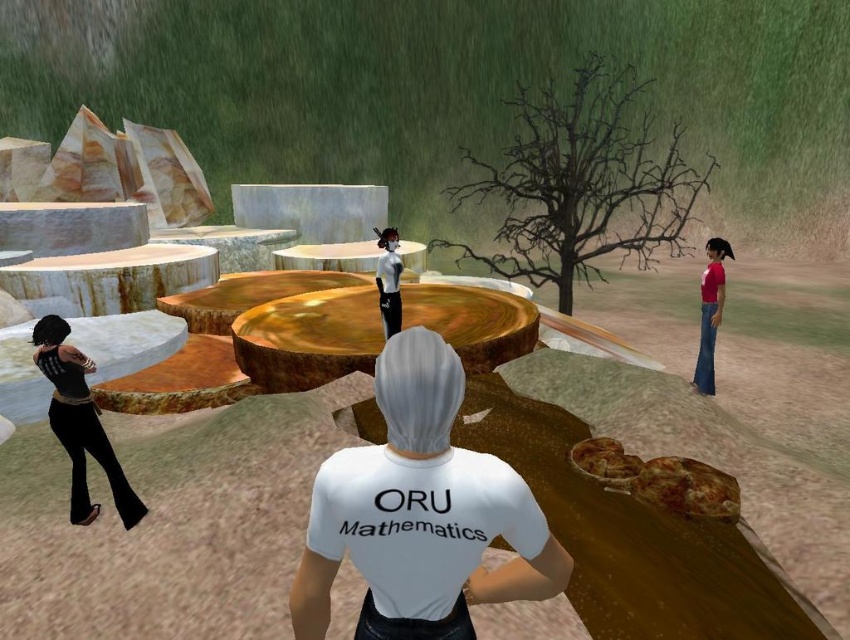
Question: Is white matte shirt at center closer to the viewer compared to velvet black pants at left?

Choices:
 (A) yes
 (B) no

Answer: (A)

Question: Does matte red shirt at right have a lesser width compared to black glossy shirt at center?

Choices:
 (A) no
 (B) yes

Answer: (B)

Question: Which point is closer to the camera taking this photo?

Choices:
 (A) (384, 332)
 (B) (400, 436)

Answer: (B)

Question: Is matte red shirt at right closer to camera compared to black glossy shirt at center?

Choices:
 (A) yes
 (B) no

Answer: (B)

Question: Among these points, which one is farthest from the camera?

Choices:
 (A) click(429, 385)
 (B) click(717, 248)

Answer: (B)

Question: Which of the following is the closest to the observer?

Choices:
 (A) (511, 212)
 (B) (381, 289)

Answer: (B)